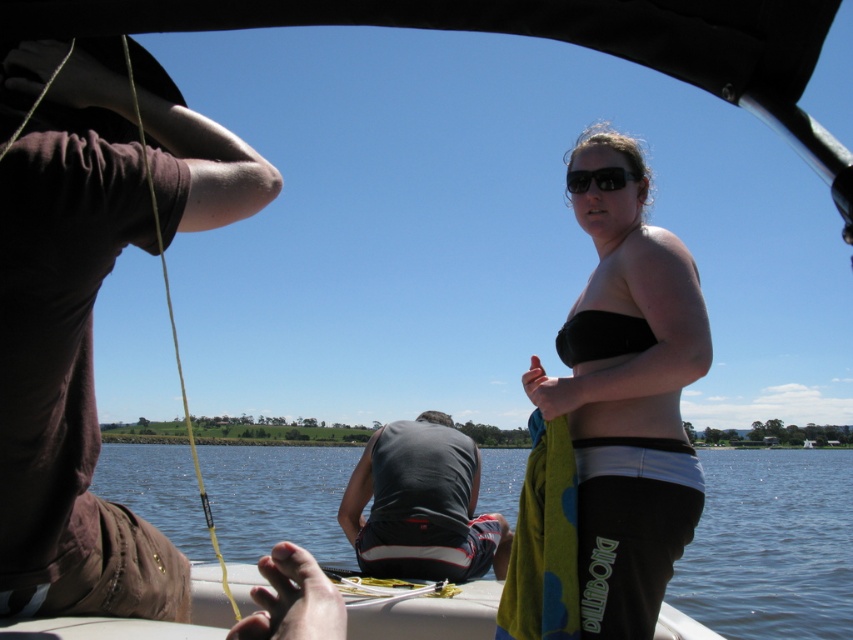
You are on a boat and need to determine clothing sizes for a photoshoot. If the dark gray fabric shirt at center and the black matte bikini top at center are both centered, which clothing item has a greater width?

The dark gray fabric shirt at center has a greater width than the black matte bikini top at center according to the description.

You are sitting in a boat and want to put your black matte sunglasses at upper center somewhere. Considering the size of clear water at center, can you place the sunglasses on the water?

The clear water at center has a larger size compared to black matte sunglasses at upper center. Yes, you can place the sunglasses on the clear water at center since the water is bigger than the sunglasses.